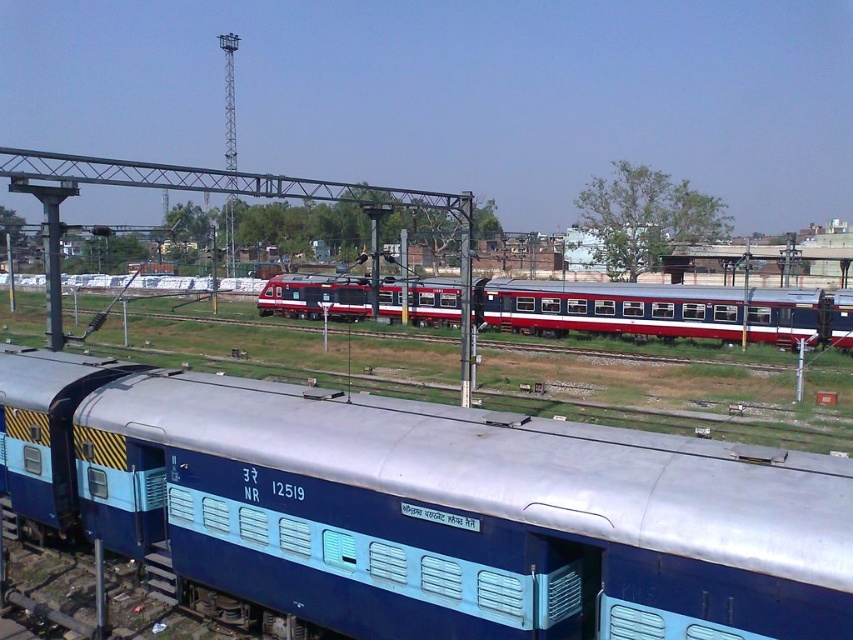
Which is more to the left, blue metallic train car at lower left or red glossy passenger train at center?

From the viewer's perspective, blue metallic train car at lower left appears more on the left side.

Is point (212, 554) farther from viewer compared to point (495, 321)?

That is False.

At what (x,y) coordinates should I click in order to perform the action: click on blue metallic train car at lower left. Please return your answer as a coordinate pair (x, y). Looking at the image, I should click on (421, 509).